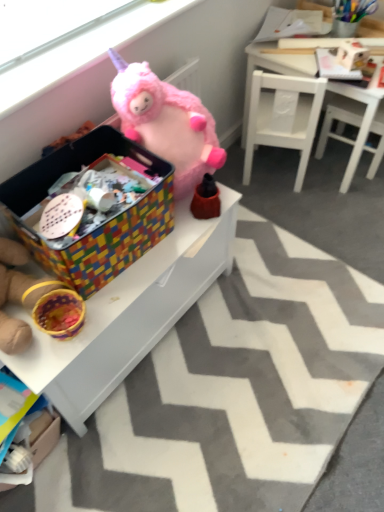
The image size is (384, 512). Identify the location of free space above pink plush unicorn at upper center (from a real-world perspective). click(x=82, y=40).